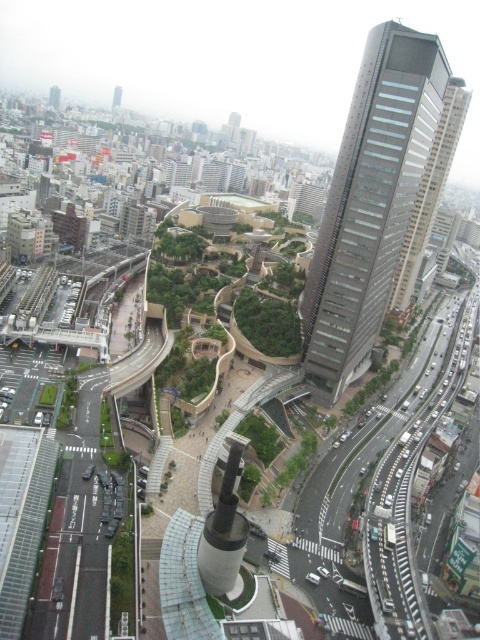
Question: Among these points, which one is nearest to the camera?

Choices:
 (A) (55, 92)
 (B) (111, 100)

Answer: (A)

Question: Is the position of matte glass skyscraper at upper right more distant than that of gray concrete skyscraper at upper center?

Choices:
 (A) no
 (B) yes

Answer: (B)

Question: Is gray glass skyscraper at right positioned in front of matte glass skyscraper at upper right?

Choices:
 (A) no
 (B) yes

Answer: (B)

Question: Which point appears closest to the camera in this image?

Choices:
 (A) (59, 99)
 (B) (115, 106)
 (C) (354, 326)

Answer: (C)

Question: Which object is the farthest from the matte glass skyscraper at upper right?

Choices:
 (A) gray glass skyscraper at right
 (B) gray concrete skyscraper at upper center

Answer: (A)

Question: Is gray glass skyscraper at right in front of gray concrete skyscraper at upper center?

Choices:
 (A) no
 (B) yes

Answer: (B)